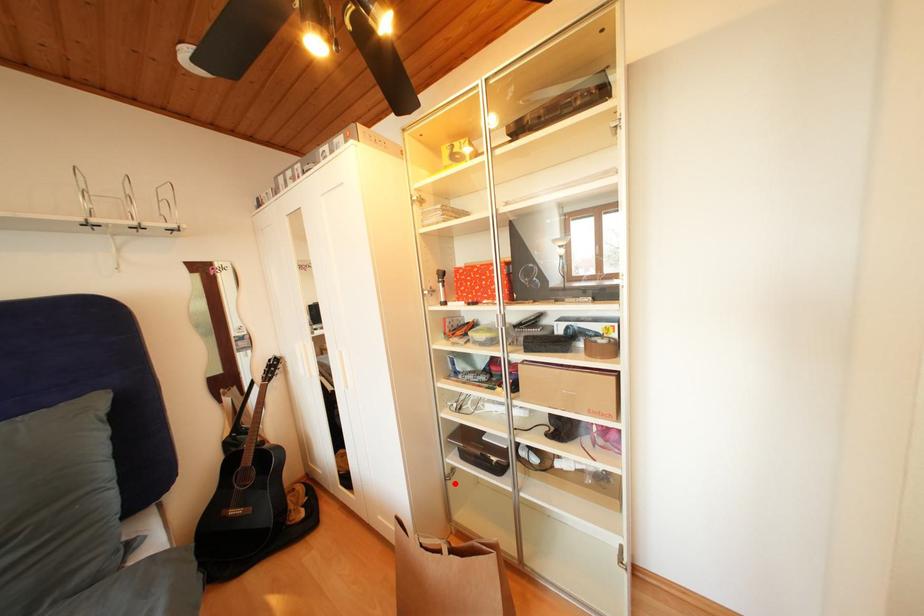
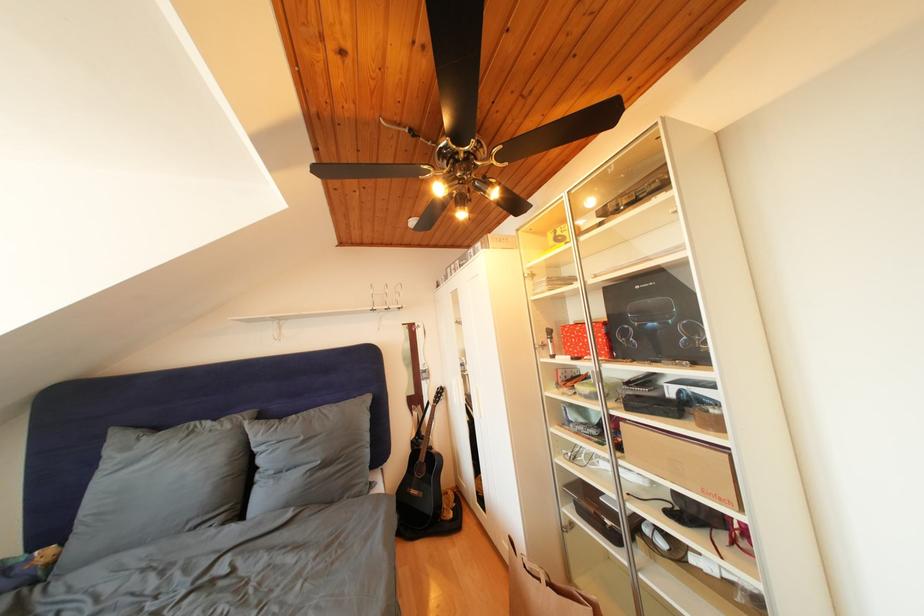
Where in the second image is the point corresponding to the highlighted location from the first image?

(572, 533)